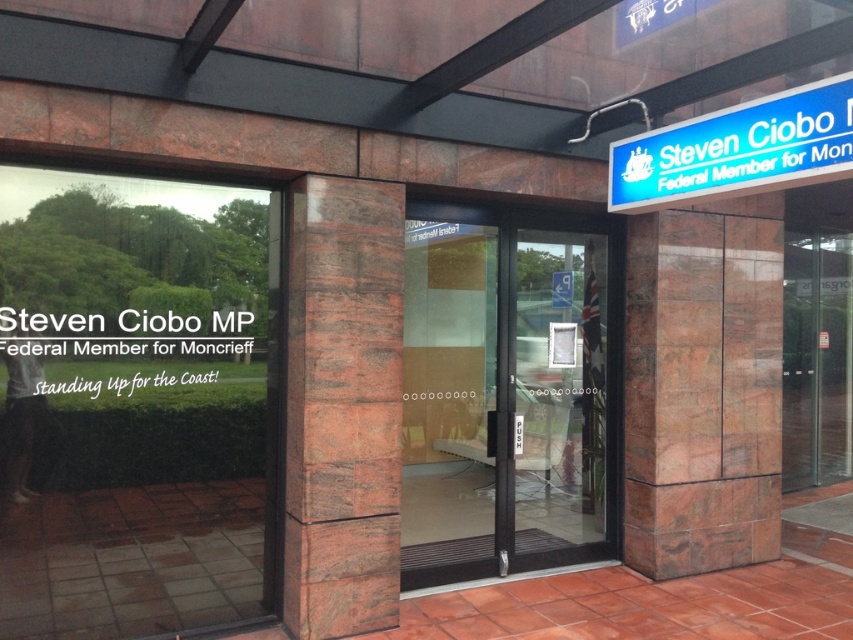
Consider the image. You are a visitor arriving at the entrance of the building. You need to locate the black glass door at center and the blue plastic sign at upper right. Based on their positions, which object is closer to the right side of the entrance?

The blue plastic sign at upper right is closer to the right side of the entrance because the black glass door at center is to the left of it.

You are standing in front of the building entrance and need to locate the main entrance door. Based on the scene description, where should you look to find the black glass door at center?

The black glass door at center is located at the central area of the entrance, specifically at coordinates point (505, 392).